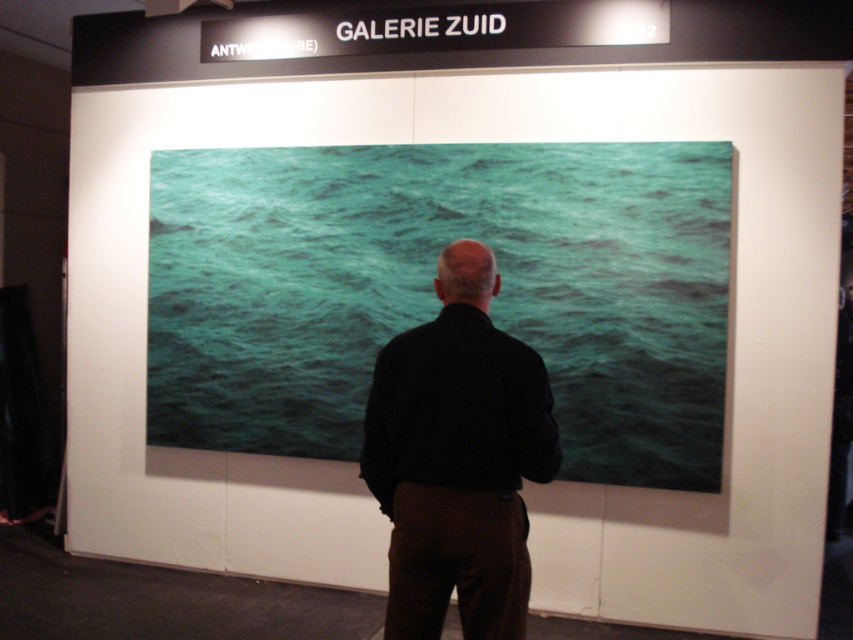
You are standing in front of the artwork at GALERIE ZUID. You notice two points marked on the wall. The first point is at coordinates point (563, 440) and the second point is at point (405, 432). From your perspective, which point is closer to you?

Point (405, 432) is closer to you because it is in front of point (563, 440), which is behind it.

You are standing in front of the artwork and want to touch the exact center of the teal glossy water at center. Given that the coordinates of the center are marked by point (433, 296), can you reach it without moving your current position?

The point (433, 296) marks the exact center of the teal glossy water at center. Since you are already standing in front of the artwork, you can reach it without moving your current position by extending your arm towards the coordinates.

You are an art critic analyzing the composition of the artwork displayed in the scene. Based on the spatial relationship between the teal glossy water at center and the black matte shirt at center, which object occupies a larger vertical space in the artwork?

The teal glossy water at center has a greater height compared to the black matte shirt at center, so it occupies a larger vertical space in the artwork.